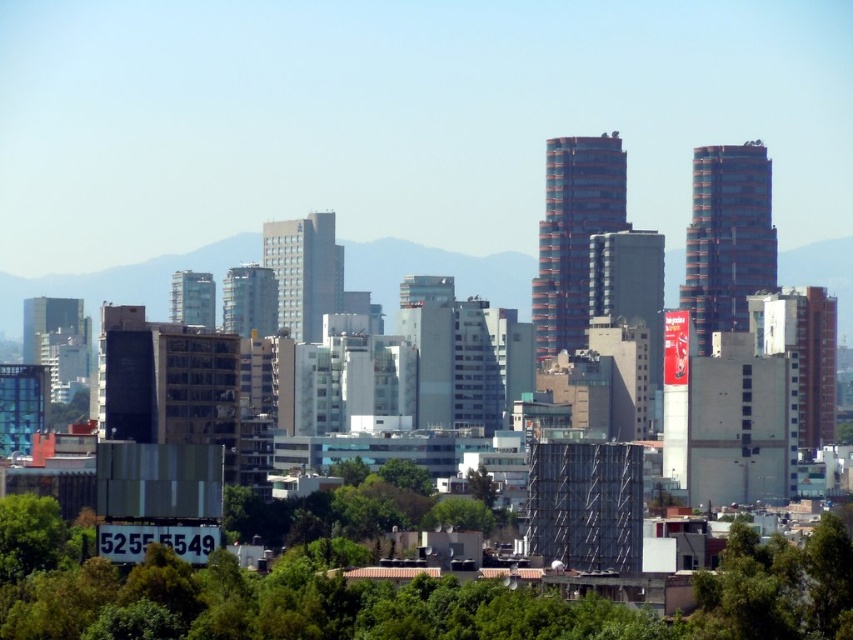
Is green leafy tree at lower right smaller than green leafy tree at lower center?

Yes.

Describe the element at coordinates (776, 588) in the screenshot. This screenshot has width=853, height=640. I see `green leafy tree at lower right` at that location.

You are a GUI agent. You are given a task and a screenshot of the screen. Output one action in this format:
    pyautogui.click(x=<x>, y=<y>)
    Task: Click on the green leafy tree at lower right
    
    Given the screenshot: What is the action you would take?
    pyautogui.click(x=776, y=588)

I want to click on green leafy tree at lower right, so click(x=776, y=588).